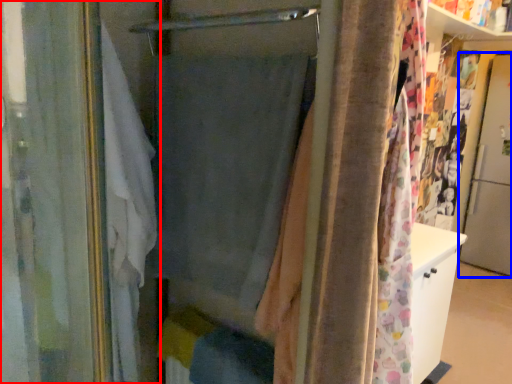
Question: Which of the following is the closest to the observer, curtain (highlighted by a red box) or screen door (highlighted by a blue box)?

Choices:
 (A) curtain
 (B) screen door

Answer: (A)